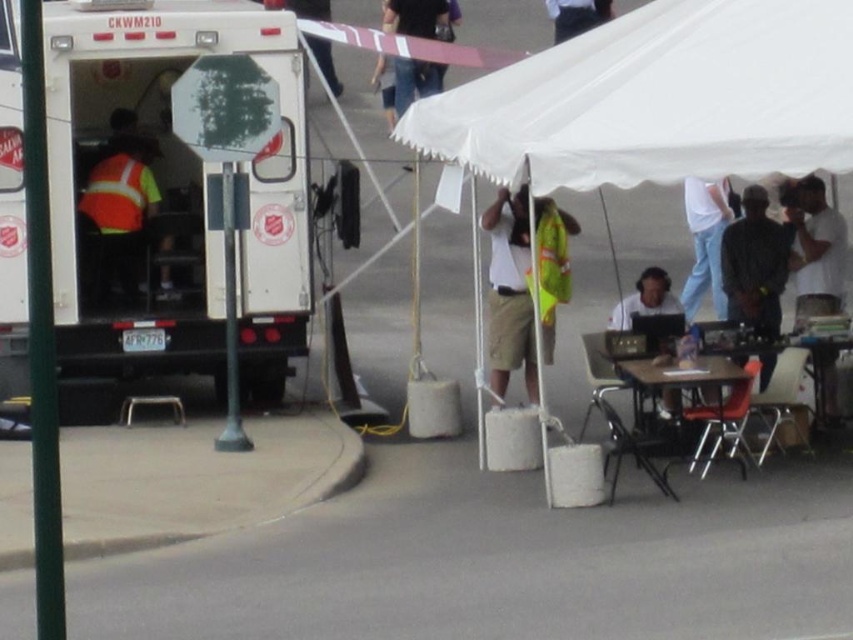
You are setting up a picnic area and have a picnic blanket that is 2 meters wide. You want to place it under the white fabric tent at center and on the wooden table at lower right. Which surface can accommodate the picnic blanket based on their widths?

The white fabric tent at center has a greater width than the wooden table at lower right. Since the picnic blanket is 2 meters wide, it can fit under the white fabric tent at center if its width is at least 2 meters. However, the wooden table at lower right is narrower, so it may not accommodate the blanket.

You are standing at the base of the signpost with the stop sign. Looking towards the Salvation Army truck, where would you see the white fabric canopy at upper center located relative to your position?

The white fabric canopy at upper center is located at point 0.156 on the horizontal axis and 0.773 on the vertical axis from your position at the signpost base.